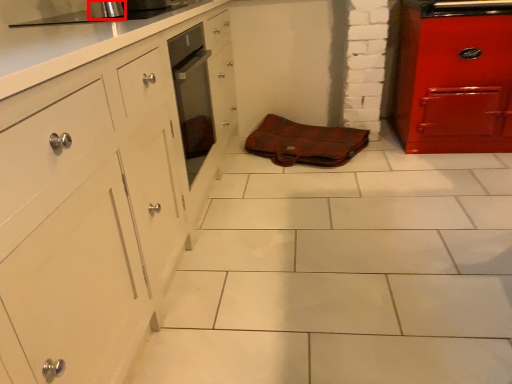
Question: From the image's perspective, considering the relative positions of appliance (annotated by the red box) and material in the image provided, where is appliance (annotated by the red box) located with respect to the staircase?

Choices:
 (A) above
 (B) below

Answer: (A)